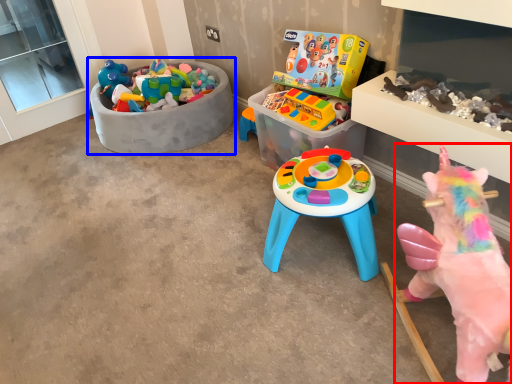
Question: Which object appears closest to the camera in this image, toy (highlighted by a red box) or toy (highlighted by a blue box)?

Choices:
 (A) toy
 (B) toy

Answer: (A)